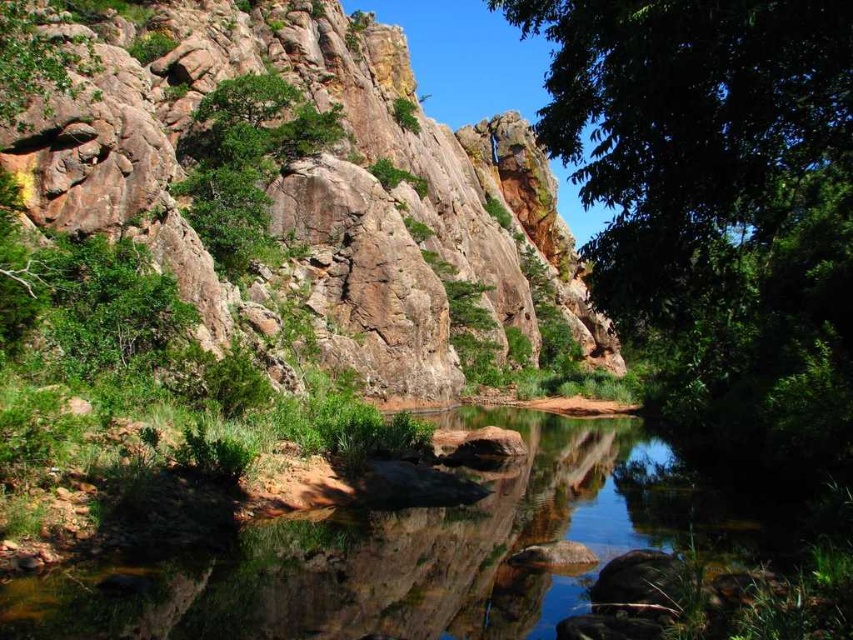
Between point (561, 604) and point (236, 269), which one is positioned in front?

Positioned in front is point (561, 604).

Consider the image. Who is lower down, clear water at center or green rough textured tree at upper center?

Positioned lower is clear water at center.

Is point (735, 545) closer to camera compared to point (225, 147)?

Yes, point (735, 545) is closer to viewer.

Find the location of `clear water at center`. clear water at center is located at coordinates (416, 554).

Is rustic stone hillside at upper center behind clear water at center?

Yes, rustic stone hillside at upper center is further from the viewer.

Who is more distant from viewer, (424, 376) or (506, 573)?

Positioned behind is point (424, 376).

This screenshot has width=853, height=640. Find the location of `rustic stone hillside at upper center`. rustic stone hillside at upper center is located at coordinates (306, 188).

Does point (277, 51) come farther from viewer compared to point (222, 134)?

Yes, point (277, 51) is farther from viewer.

This screenshot has height=640, width=853. Describe the element at coordinates (306, 188) in the screenshot. I see `rustic stone hillside at upper center` at that location.

Identify the location of rustic stone hillside at upper center. The height and width of the screenshot is (640, 853). (306, 188).